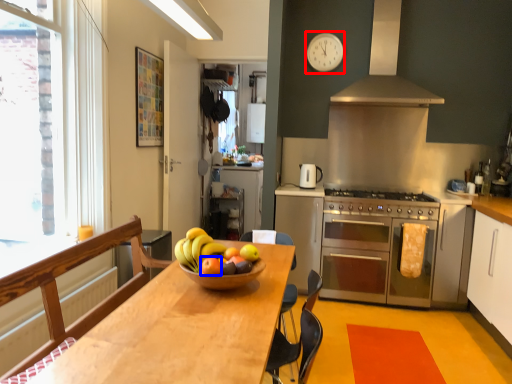
Question: Which point is further to the camera, clock (highlighted by a red box) or apple (highlighted by a blue box)?

Choices:
 (A) clock
 (B) apple

Answer: (A)